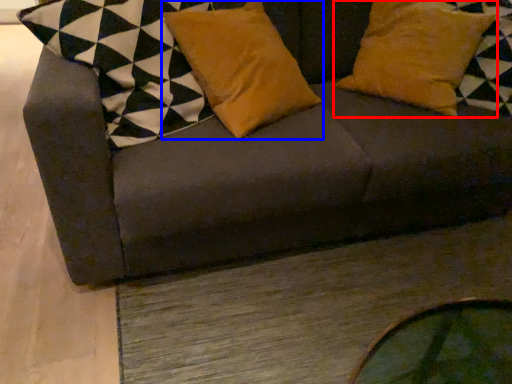
Question: Which object is closer to the camera taking this photo, pillow (highlighted by a red box) or pillow (highlighted by a blue box)?

Choices:
 (A) pillow
 (B) pillow

Answer: (B)